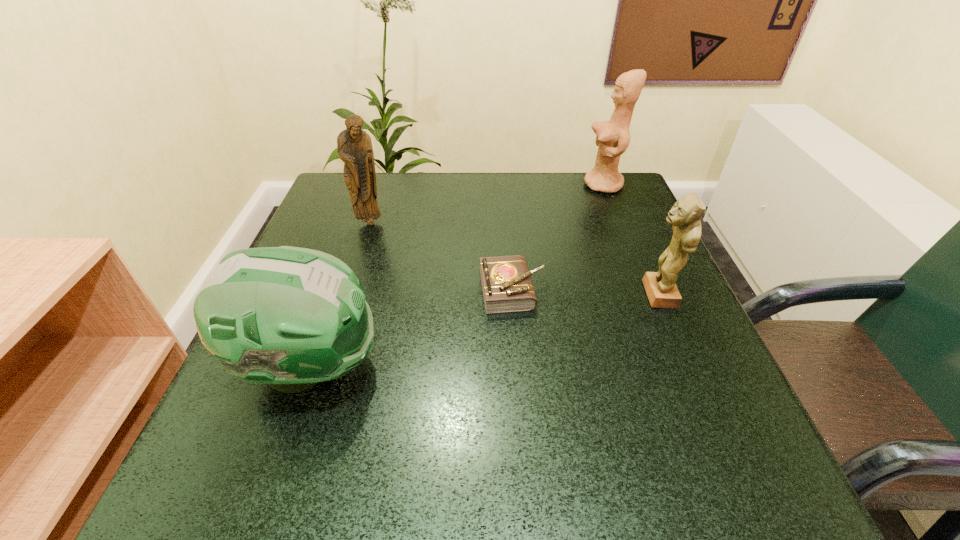
You are a GUI agent. You are given a task and a screenshot of the screen. Output one action in this format:
    pyautogui.click(x=<x>, y=<y>)
    Task: Click on the farthest object
    This screenshot has height=540, width=960.
    Given the screenshot: What is the action you would take?
    pyautogui.click(x=613, y=137)

At what (x,y) coordinates should I click in order to perform the action: click on the fourth nearest object. Please return your answer as a coordinate pair (x, y). Looking at the image, I should click on (354, 146).

Locate an element on the screen. the second farthest figurine is located at coordinates (354, 146).

Find the location of `football helmet`. football helmet is located at coordinates (290, 317).

Where is `the shortest figurine`? This screenshot has width=960, height=540. the shortest figurine is located at coordinates (684, 216).

Locate an element on the screen. diary is located at coordinates (507, 287).

Find the location of a particular element. This screenshot has height=540, width=960. the shortest object is located at coordinates (507, 287).

Where is `free space located on the front-facing side of the farthest object`? free space located on the front-facing side of the farthest object is located at coordinates (488, 185).

At what (x,y) coordinates should I click in order to perform the action: click on vacant space located 0.090m on the front-facing side of the farthest object. Please return your answer as a coordinate pair (x, y). The image size is (960, 540). Looking at the image, I should click on (549, 185).

Locate an element on the screen. Image resolution: width=960 pixels, height=540 pixels. vacant space located 0.210m on the front-facing side of the farthest object is located at coordinates (503, 185).